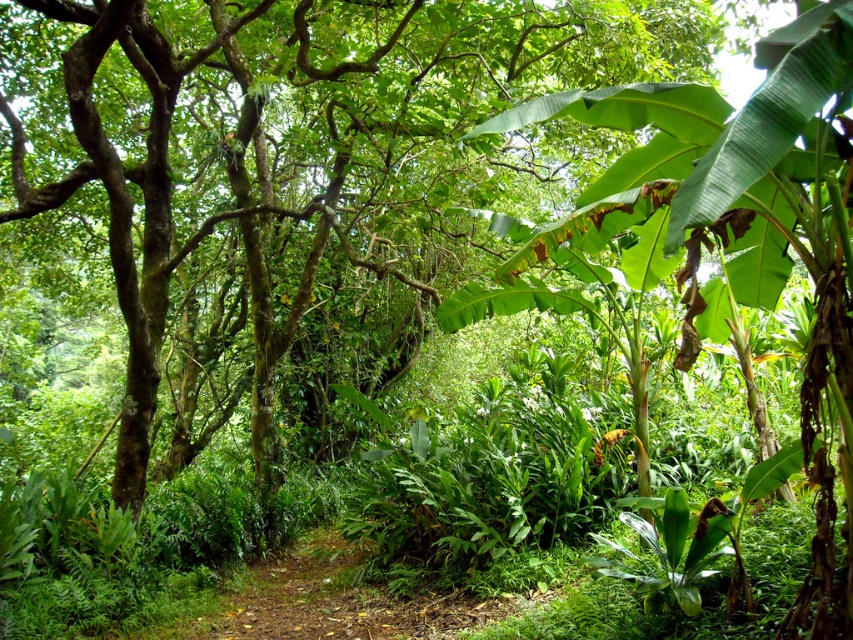
At what (x,y) coordinates should I click in order to perform the action: click on green leafy tree at center. Please return your answer as a coordinate pair (x, y). The image size is (853, 640). Looking at the image, I should click on (292, 176).

Can you confirm if green leafy tree at center is taller than green leafy banana tree at right?

Correct, green leafy tree at center is much taller as green leafy banana tree at right.

Where is `green leafy tree at center`? The height and width of the screenshot is (640, 853). green leafy tree at center is located at coordinates (292, 176).